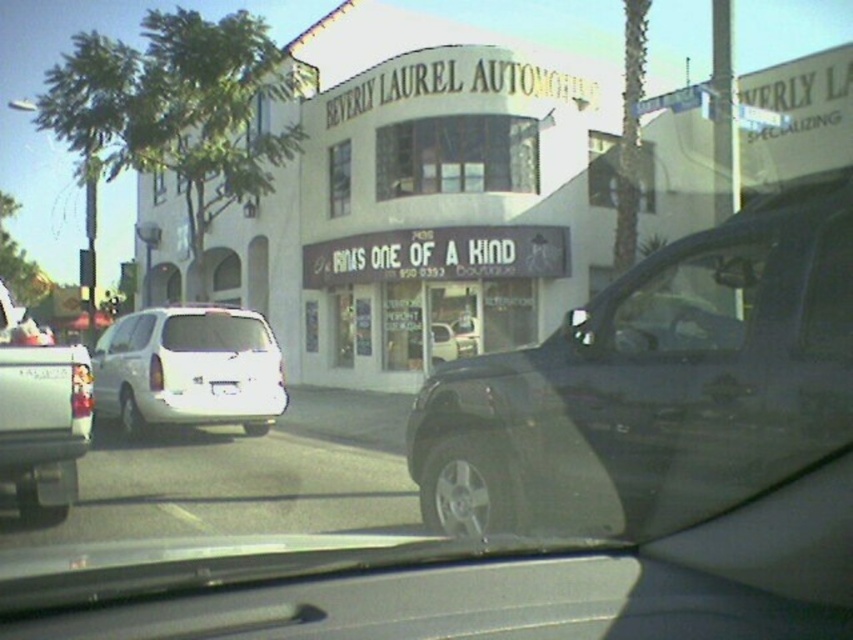
You are driving a vehicle and notice a shiny black car at center and a clear glass window at center outside. Which object appears taller from your current viewpoint?

The shiny black car at center appears taller than the clear glass window at center from your current viewpoint.

You are driving a car and need to determine if there is enough space to park between the shiny black car at center and the clear glass windshield at center. The length of your car is 15 feet. Can you fit your car in the space between them?

The space between the shiny black car at center and the clear glass windshield at center is 23.91 feet. Since your car is 15 feet long, there is sufficient space to park between them.